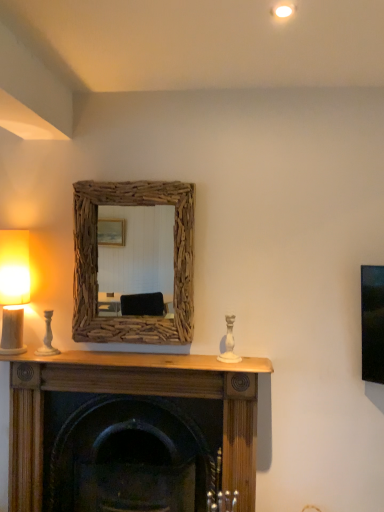
Question: From a real-world perspective, is driftwood mirror at center under matte white table lamp at left?

Choices:
 (A) no
 (B) yes

Answer: (A)

Question: Is matte white table lamp at left surrounded by driftwood mirror at center?

Choices:
 (A) yes
 (B) no

Answer: (B)

Question: Is driftwood mirror at center thinner than matte white table lamp at left?

Choices:
 (A) yes
 (B) no

Answer: (A)

Question: Can we say driftwood mirror at center lies outside matte white table lamp at left?

Choices:
 (A) no
 (B) yes

Answer: (B)

Question: From a real-world perspective, is driftwood mirror at center over matte white table lamp at left?

Choices:
 (A) yes
 (B) no

Answer: (A)

Question: Does driftwood mirror at center have a larger size compared to matte white table lamp at left?

Choices:
 (A) yes
 (B) no

Answer: (A)

Question: Does matte white table lamp at left come in front of driftwood mirror at center?

Choices:
 (A) no
 (B) yes

Answer: (B)

Question: Could you tell me if matte white table lamp at left is facing driftwood mirror at center?

Choices:
 (A) no
 (B) yes

Answer: (A)

Question: Is matte white table lamp at left to the left of driftwood mirror at center from the viewer's perspective?

Choices:
 (A) yes
 (B) no

Answer: (A)

Question: Is the depth of matte white table lamp at left greater than that of driftwood mirror at center?

Choices:
 (A) yes
 (B) no

Answer: (B)

Question: Considering the relative sizes of matte white table lamp at left and driftwood mirror at center in the image provided, is matte white table lamp at left thinner than driftwood mirror at center?

Choices:
 (A) yes
 (B) no

Answer: (B)

Question: Is driftwood mirror at center at the back of matte white table lamp at left?

Choices:
 (A) no
 (B) yes

Answer: (A)

Question: Does wooden fireplace at center have a larger size compared to driftwood mirror at center?

Choices:
 (A) no
 (B) yes

Answer: (B)